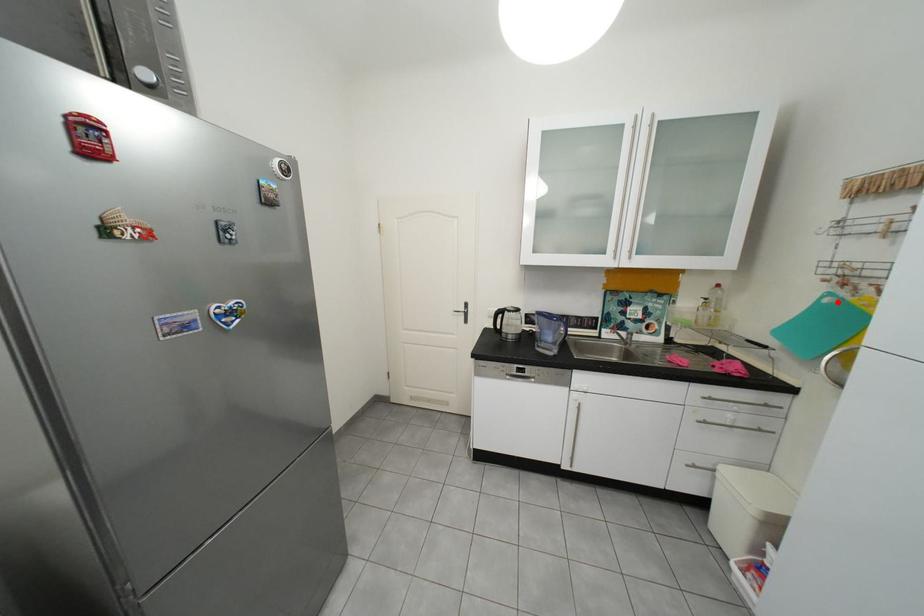
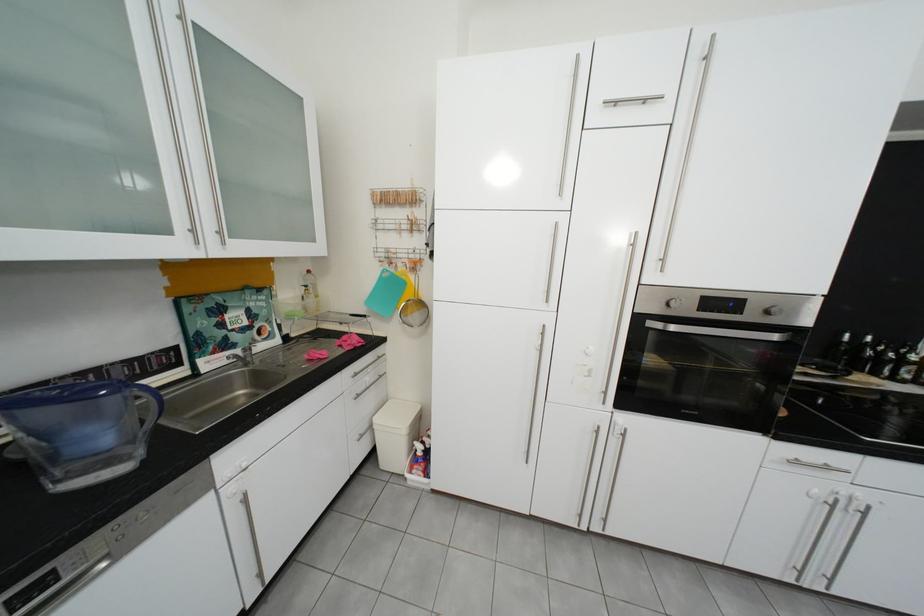
Where in the second image is the point corresponding to the highlighted location from the first image?

(395, 276)